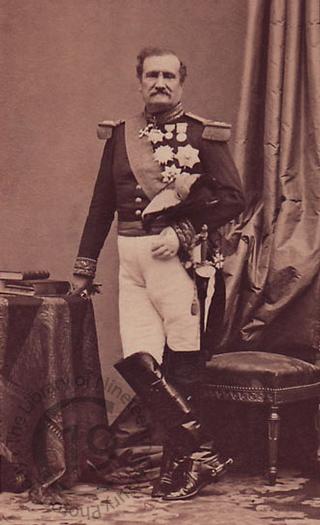
Locate an element on the screen. The image size is (320, 525). sash is located at coordinates (148, 174).